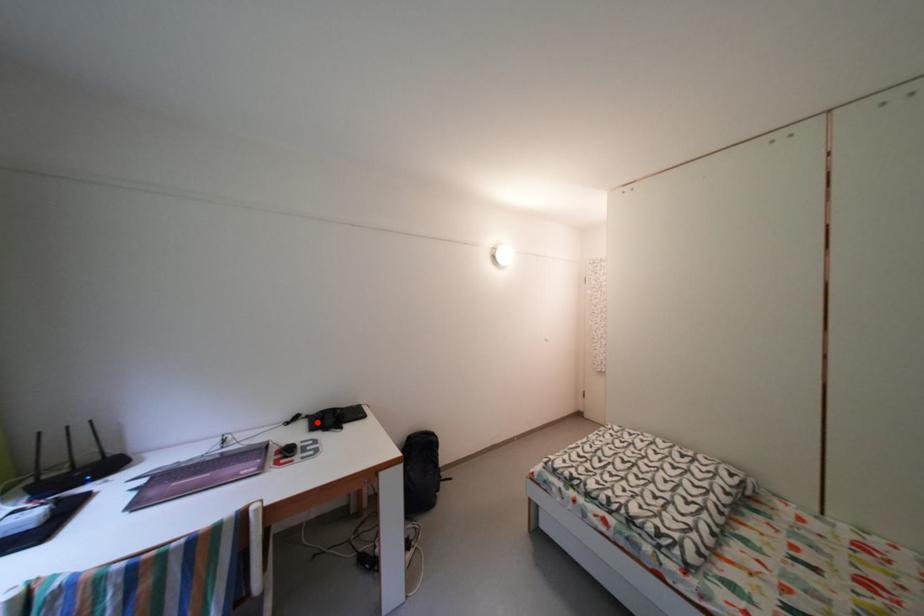
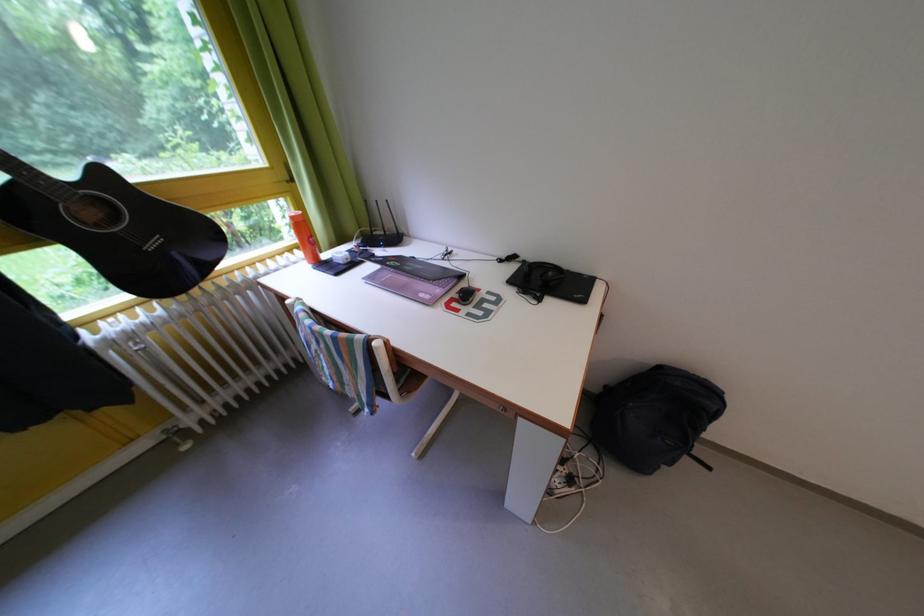
Find the pixel in the second image that matches the highlighted location in the first image.

(533, 267)